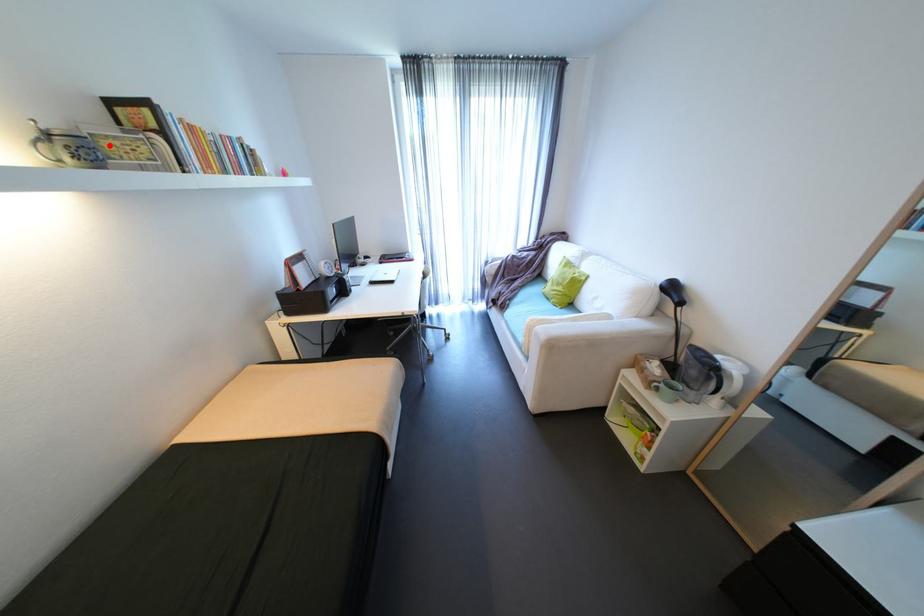
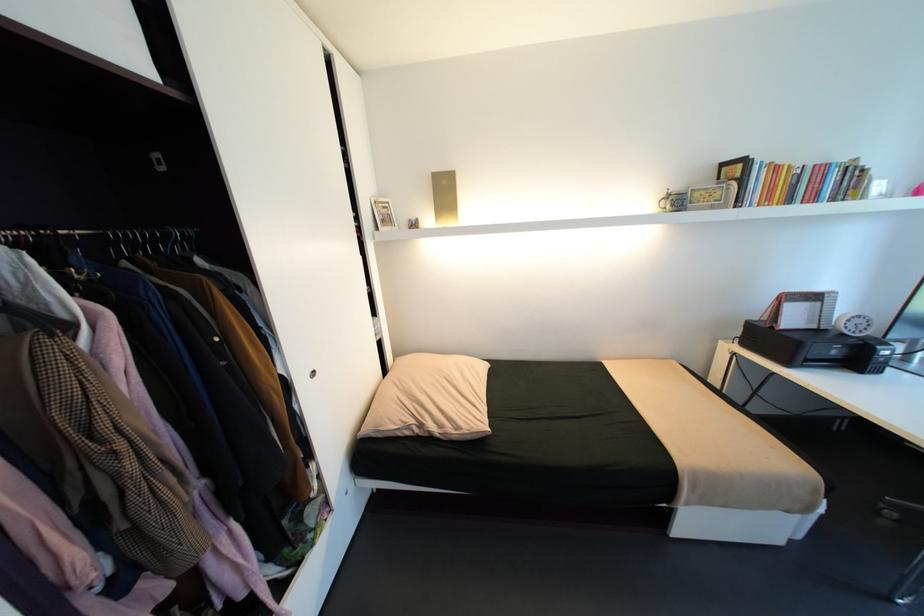
Find the pixel in the second image that matches the highlighted location in the first image.

(700, 196)